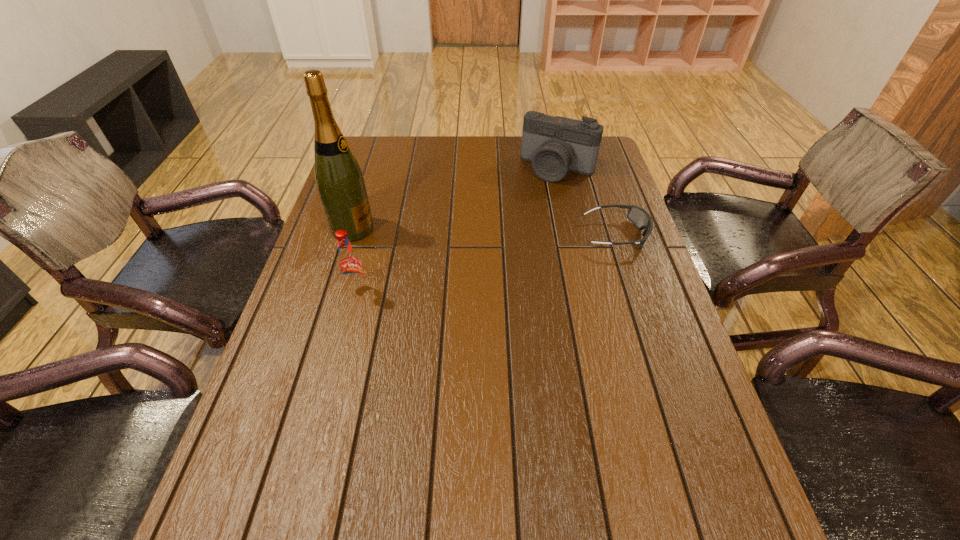
The width and height of the screenshot is (960, 540). Identify the location of vacant spot on the desktop that is between the root beer and the goggles and is positioned at the lens of the camera. (504, 259).

The width and height of the screenshot is (960, 540). What are the coordinates of `free space on the desktop that is between the root beer and the goggles and is positioned on the front-facing side of the tallest object` in the screenshot? It's located at (516, 256).